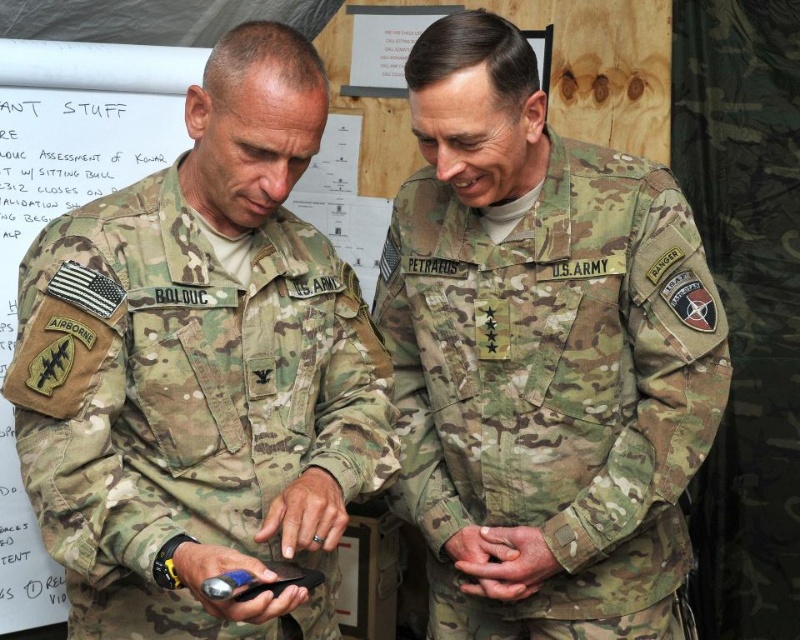
You are a photographer trying to capture a clear photo of both the camouflage uniform at center and the camouflage fabric us army uniform at center. Which one will appear larger in the photo?

The camouflage uniform at center will appear larger in the photo since it is closer to the viewer than the camouflage fabric us army uniform at center.